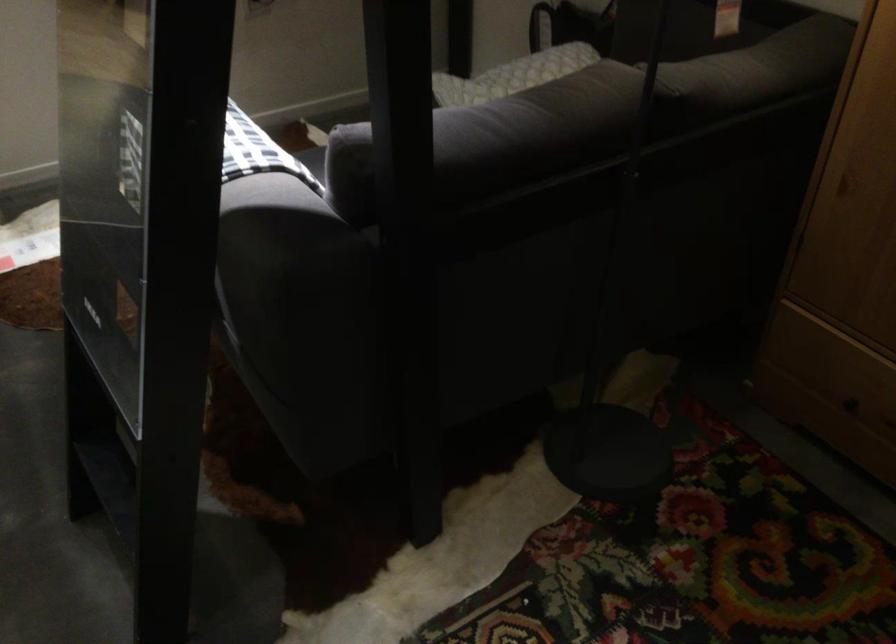
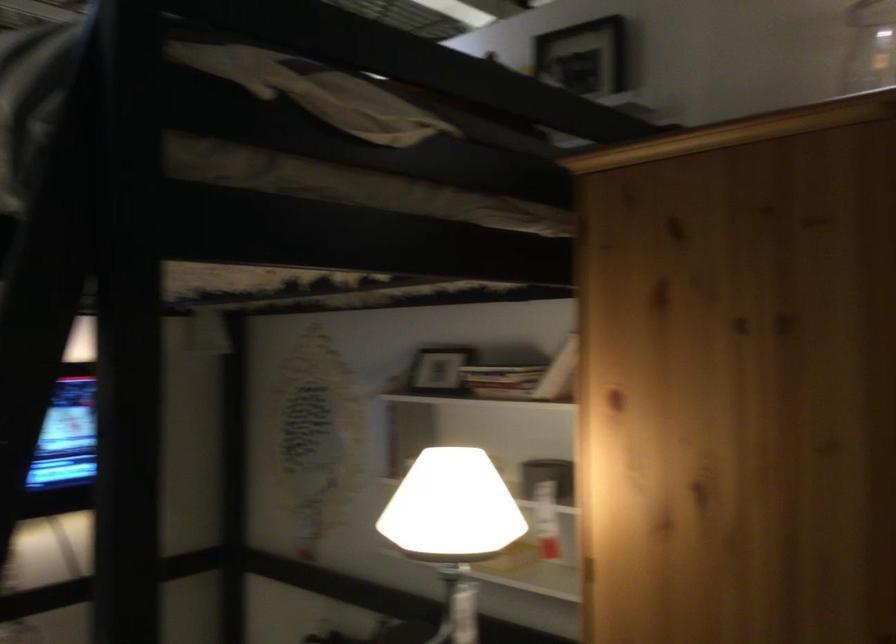
First-person continuous shooting, in which direction is the camera rotating?

The camera rotated toward right-up.